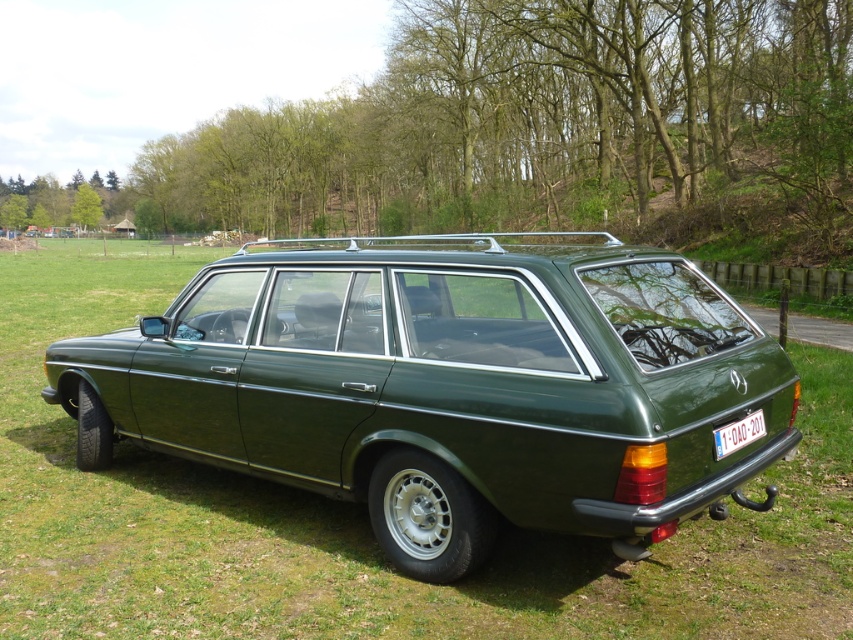
You are standing at the point marked by the coordinates point [448,385] in the image. What object are you directly facing?

The point [448,385] marks the green matte station wagon at center, so you are directly facing the green matte station wagon at center.

You are a photographer standing at a certain distance from the green matte station wagon at center. You want to take a photo that captures the entire car without any cropping. Considering the camera you are using has a standard lens with a maximum focal length of 50mm, which is suitable for capturing objects up to 10 feet away. Can you take the photo from your current position?

The green matte station wagon at center is 9.34 feet away from the camera. Since the maximum focal length of 50mm can capture objects up to 10 feet away, you can take the photo from your current position without cropping.

Based on the photo, you are standing at the point with coordinates point (737, 428) and want to walk to the car parked at point (541, 352). Which direction should you move to reach the car?

You should move forward because point (541, 352) is in front of point (737, 428).